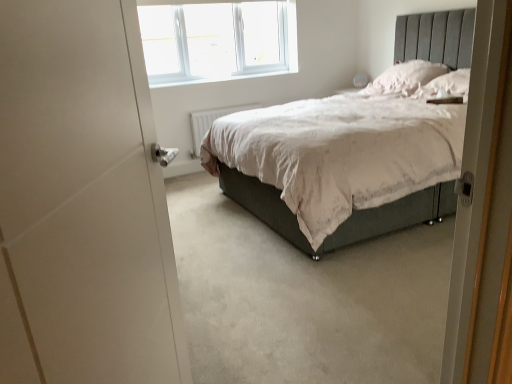
Describe the element at coordinates (406, 77) in the screenshot. I see `pink fabric pillow at upper right, which is counted as the second pillow, starting from the front` at that location.

Image resolution: width=512 pixels, height=384 pixels. What do you see at coordinates (446, 86) in the screenshot?
I see `white soft pillow at upper right, marked as the 2th pillow in a back-to-front arrangement` at bounding box center [446, 86].

The width and height of the screenshot is (512, 384). What do you see at coordinates (82, 202) in the screenshot?
I see `white matte door at left` at bounding box center [82, 202].

In order to click on white plastic window at upper center in this screenshot , I will do `click(217, 40)`.

Does pink fabric pillow at upper right, which is counted as the second pillow, starting from the front, appear on the right side of white matte door at left?

Yes, pink fabric pillow at upper right, which is counted as the second pillow, starting from the front, is to the right of white matte door at left.

From the image's perspective, relative to white matte door at left, is pink fabric pillow at upper right, which is the 1th pillow in back-to-front order, above or below?

pink fabric pillow at upper right, which is the 1th pillow in back-to-front order, is above white matte door at left.

The width and height of the screenshot is (512, 384). I want to click on screen door that appears on the left of pink fabric pillow at upper right, which is counted as the second pillow, starting from the front, so click(82, 202).

Is pink fabric pillow at upper right, which is counted as the second pillow, starting from the front, smaller than white matte door at left?

Yes, pink fabric pillow at upper right, which is counted as the second pillow, starting from the front, is smaller than white matte door at left.

Between pink fabric pillow at upper right, which is the 1th pillow in back-to-front order, and white soft pillow at upper right, which is the first pillow in front-to-back order, which one has less height?

With less height is white soft pillow at upper right, which is the first pillow in front-to-back order.

Is point (408, 85) more distant than point (469, 71)?

Yes, point (408, 85) is farther from viewer.

From a real-world perspective, is pink fabric pillow at upper right, which is counted as the second pillow, starting from the front, located higher than white soft pillow at upper right, marked as the 2th pillow in a back-to-front arrangement?

Yes.

In the scene shown: How different are the orientations of white soft pillow at upper right, marked as the 2th pillow in a back-to-front arrangement, and white plastic radiator at center in degrees?

The angle between the facing direction of white soft pillow at upper right, marked as the 2th pillow in a back-to-front arrangement, and the facing direction of white plastic radiator at center is 89.4 degrees.

From a real-world perspective, is white soft pillow at upper right, marked as the 2th pillow in a back-to-front arrangement, physically located above or below white plastic radiator at center?

Clearly, from a real-world perspective, white soft pillow at upper right, marked as the 2th pillow in a back-to-front arrangement, is above white plastic radiator at center.

Which object is thinner, white soft pillow at upper right, which is the first pillow in front-to-back order, or white plastic radiator at center?

Thinner between the two is white plastic radiator at center.

Which is more to the left, white soft pillow at upper right, marked as the 2th pillow in a back-to-front arrangement, or white plastic radiator at center?

From the viewer's perspective, white plastic radiator at center appears more on the left side.

Consider the image. From the image's perspective, between white plastic radiator at center and white soft pillow at upper right, marked as the 2th pillow in a back-to-front arrangement, which one is located above?

white soft pillow at upper right, marked as the 2th pillow in a back-to-front arrangement, is shown above in the image.

Is white plastic radiator at center further to camera compared to white soft pillow at upper right, which is the first pillow in front-to-back order?

Yes, the depth of white plastic radiator at center is greater than that of white soft pillow at upper right, which is the first pillow in front-to-back order.

Is white plastic radiator at center smaller than white soft pillow at upper right, marked as the 2th pillow in a back-to-front arrangement?

Indeed, white plastic radiator at center has a smaller size compared to white soft pillow at upper right, marked as the 2th pillow in a back-to-front arrangement.

Visually, is white plastic radiator at center positioned to the left or to the right of white soft pillow at upper right, which is the first pillow in front-to-back order?

white plastic radiator at center is positioned on white soft pillow at upper right, which is the first pillow in front-to-back order,'s left side.

Which is correct: white soft pillow at upper right, marked as the 2th pillow in a back-to-front arrangement, is inside pink fabric pillow at upper right, which is the 1th pillow in back-to-front order, or outside of it?

white soft pillow at upper right, marked as the 2th pillow in a back-to-front arrangement, is spatially situated outside pink fabric pillow at upper right, which is the 1th pillow in back-to-front order.

The width and height of the screenshot is (512, 384). I want to click on pillow above the white soft pillow at upper right, which is the first pillow in front-to-back order (from a real-world perspective), so click(406, 77).

Which is in front, white soft pillow at upper right, which is the first pillow in front-to-back order, or pink fabric pillow at upper right, which is counted as the second pillow, starting from the front?

white soft pillow at upper right, which is the first pillow in front-to-back order.

From the image's perspective, which object appears higher, white soft pillow at upper right, which is the first pillow in front-to-back order, or pink fabric pillow at upper right, which is counted as the second pillow, starting from the front?

pink fabric pillow at upper right, which is counted as the second pillow, starting from the front, from the image's perspective.

From a real-world perspective, who is located lower, white plastic window at upper center or white plastic radiator at center?

From a 3D spatial view, white plastic radiator at center is below.

From the image's perspective, is white plastic window at upper center over white plastic radiator at center?

Correct, white plastic window at upper center appears higher than white plastic radiator at center in the image.

Which object is further away from the camera taking this photo, white plastic window at upper center or white plastic radiator at center?

white plastic radiator at center is further from the camera.

From a real-world perspective, is white plastic radiator at center physically located above or below white plastic window at upper center?

Clearly, from a real-world perspective, white plastic radiator at center is below white plastic window at upper center.

The width and height of the screenshot is (512, 384). Identify the location of radiator on the right of white plastic window at upper center. (210, 122).

Is white plastic radiator at center facing towards white plastic window at upper center?

No, white plastic radiator at center is not aimed at white plastic window at upper center.

Considering the positions of objects white plastic radiator at center and white plastic window at upper center in the image provided, who is in front, white plastic radiator at center or white plastic window at upper center?

white plastic window at upper center is in front.

What are the coordinates of `pillow that is the 2nd object located above the white matte door at left (from the image's perspective)` in the screenshot? It's located at (406, 77).

The height and width of the screenshot is (384, 512). Identify the location of pillow below the pink fabric pillow at upper right, which is counted as the second pillow, starting from the front (from the image's perspective). (446, 86).

Estimate the real-world distances between objects in this image. Which object is closer to white soft pillow at upper right, marked as the 2th pillow in a back-to-front arrangement, pink fabric pillow at upper right, which is counted as the second pillow, starting from the front, or white matte door at left?

pink fabric pillow at upper right, which is counted as the second pillow, starting from the front.

Which object lies nearer to the anchor point pink fabric pillow at upper right, which is counted as the second pillow, starting from the front, white plastic radiator at center or white plastic window at upper center?

Based on the image, white plastic radiator at center appears to be nearer to pink fabric pillow at upper right, which is counted as the second pillow, starting from the front.

Estimate the real-world distances between objects in this image. Which object is further from white plastic radiator at center, pink fabric pillow at upper right, which is the 1th pillow in back-to-front order, or white soft pillow at upper right, marked as the 2th pillow in a back-to-front arrangement?

Among the two, white soft pillow at upper right, marked as the 2th pillow in a back-to-front arrangement, is located further to white plastic radiator at center.

Estimate the real-world distances between objects in this image. Which object is closer to white soft pillow at upper right, marked as the 2th pillow in a back-to-front arrangement, white plastic radiator at center or white matte door at left?

Based on the image, white plastic radiator at center appears to be nearer to white soft pillow at upper right, marked as the 2th pillow in a back-to-front arrangement.

From the image, which object appears to be nearer to white plastic radiator at center, white soft pillow at upper right, which is the first pillow in front-to-back order, or pink fabric pillow at upper right, which is the 1th pillow in back-to-front order?

Among the two, pink fabric pillow at upper right, which is the 1th pillow in back-to-front order, is located nearer to white plastic radiator at center.

Estimate the real-world distances between objects in this image. Which object is further from white plastic window at upper center, white soft pillow at upper right, marked as the 2th pillow in a back-to-front arrangement, or white matte door at left?

The object further to white plastic window at upper center is white matte door at left.

When comparing their distances from pink fabric pillow at upper right, which is counted as the second pillow, starting from the front, does white plastic window at upper center or white plastic radiator at center seem closer?

white plastic radiator at center lies closer to pink fabric pillow at upper right, which is counted as the second pillow, starting from the front, than the other object.

Based on the photo, considering their positions, is white soft pillow at upper right, which is the first pillow in front-to-back order, positioned further to pink fabric pillow at upper right, which is the 1th pillow in back-to-front order, than white plastic window at upper center?

Based on the image, white plastic window at upper center appears to be further to pink fabric pillow at upper right, which is the 1th pillow in back-to-front order.

Find the location of a particular element. This screenshot has width=512, height=384. pillow between white plastic radiator at center and white soft pillow at upper right, marked as the 2th pillow in a back-to-front arrangement is located at coordinates (406, 77).

The width and height of the screenshot is (512, 384). I want to click on window positioned between white matte door at left and white plastic radiator at center from near to far, so click(x=217, y=40).

Locate an element on the screen. pillow between white plastic window at upper center and white soft pillow at upper right, marked as the 2th pillow in a back-to-front arrangement is located at coordinates tap(406, 77).

In order to click on pillow between white matte door at left and pink fabric pillow at upper right, which is counted as the second pillow, starting from the front, from front to back in this screenshot , I will do `click(446, 86)`.